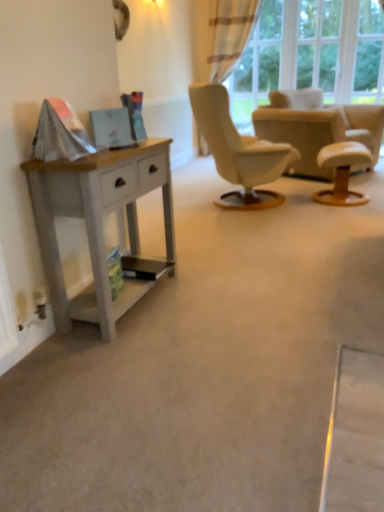
The height and width of the screenshot is (512, 384). In order to click on vacant area that lies between white wood desk at left and white leather stool at right in this screenshot , I will do `click(257, 244)`.